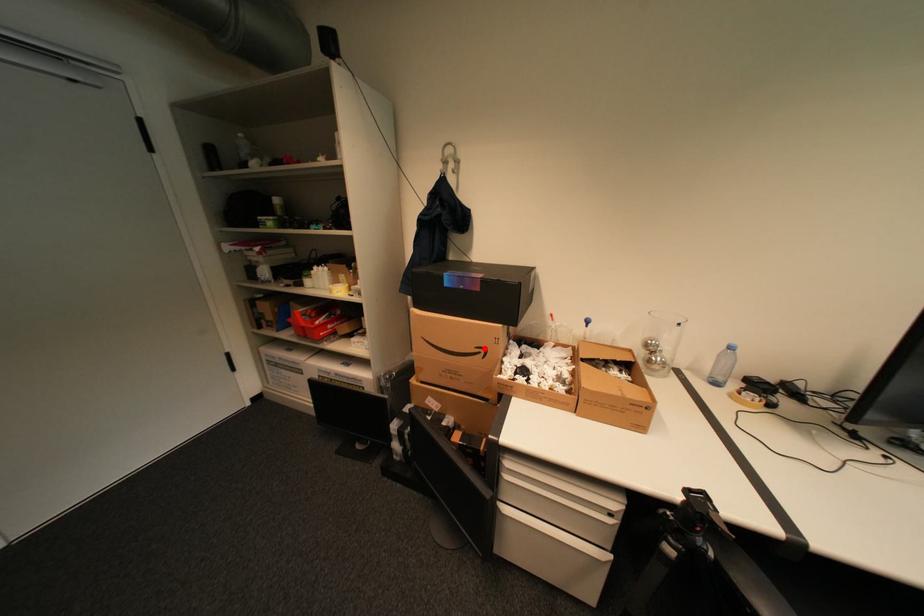
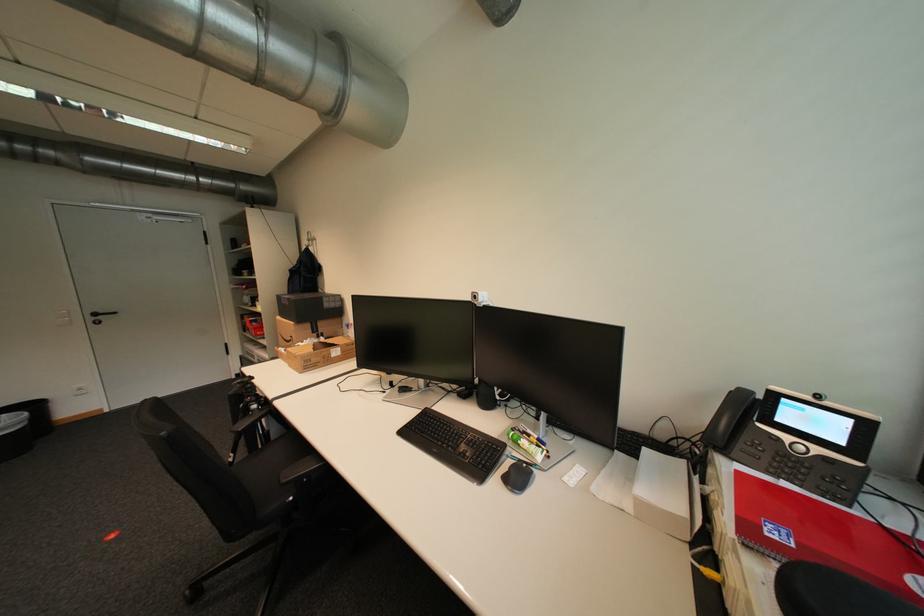
Where in the second image is the point corresponding to the highlighted location from the first image?

(299, 338)